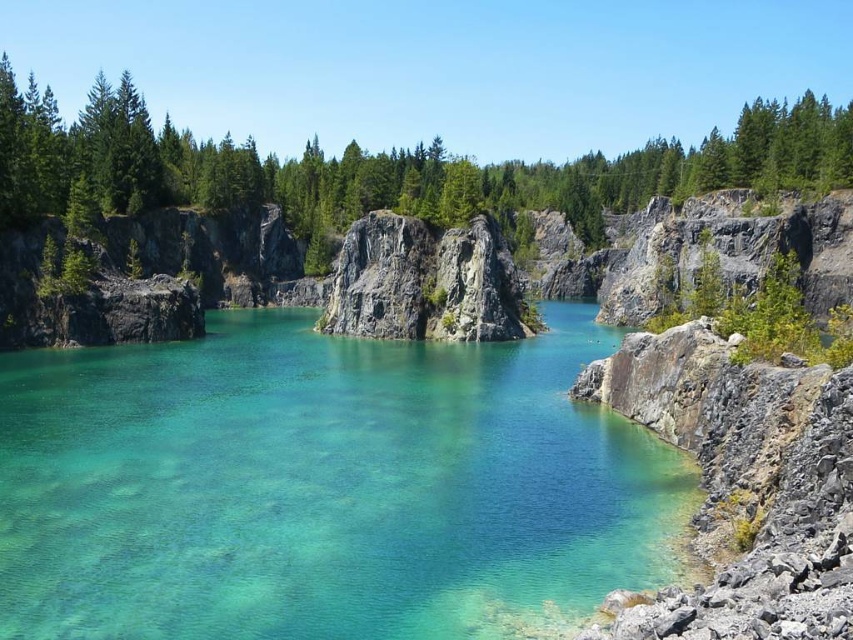
You are a hiker who wants to cross the lake. You have a small boat that can carry up to 2 meters in length. The clear glassy water at center and green matte rock at center are in your path. Which object can your boat pass through without getting stuck?

The clear glassy water at center is thinner than the green matte rock at center, so the boat can pass through the clear glassy water at center since it is thinner and allows passage, while the green matte rock at center is thicker and may block the path.

You need to place a small decorative statue that is 1.2 meters wide between the green matte rock at center and the rough granite rock at center. Can you fit it there?

The green matte rock at center might be wider than rough granite rock at center, so the distance between them may not be sufficient to accommodate the 1.2 meter wide statue. Further measurement is needed to confirm.